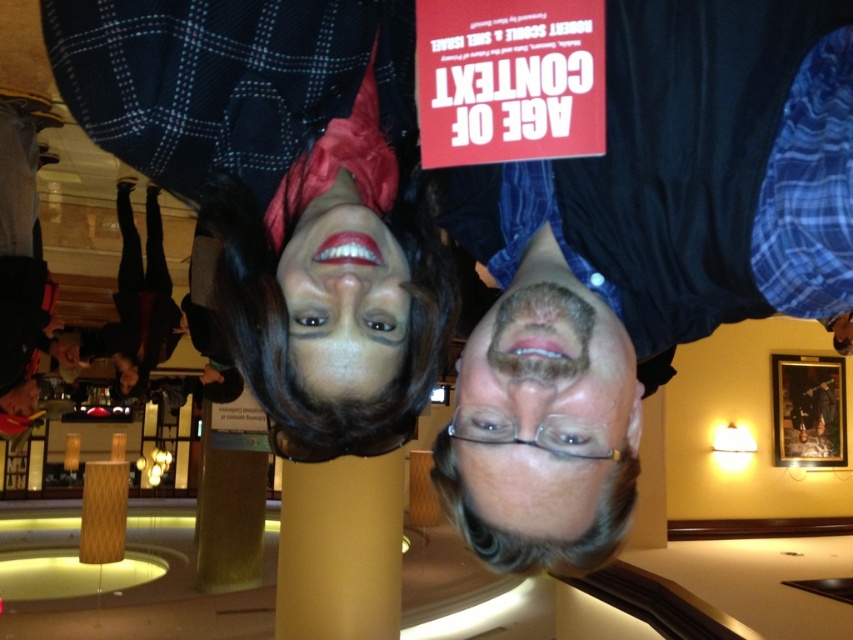
Does dark blue shirt at center have a greater height compared to matte black wig at center?

Yes.

Consider the image. How much distance is there between dark blue shirt at center and matte black wig at center?

dark blue shirt at center and matte black wig at center are 18.97 centimeters apart from each other.

Does point (613, 534) lie in front of point (354, 381)?

Yes, point (613, 534) is closer to viewer.

The width and height of the screenshot is (853, 640). I want to click on dark blue shirt at center, so (643, 257).

Does gray hair at center have a greater height compared to matte black wig at center?

Yes, gray hair at center is taller than matte black wig at center.

Image resolution: width=853 pixels, height=640 pixels. Find the location of `gray hair at center`. gray hair at center is located at coordinates (544, 410).

Who is more forward, (x=672, y=29) or (x=512, y=465)?

Point (x=512, y=465) is more forward.

Between dark blue shirt at center and gray hair at center, which one has less height?

Standing shorter between the two is gray hair at center.

This screenshot has height=640, width=853. In order to click on dark blue shirt at center in this screenshot , I will do `click(643, 257)`.